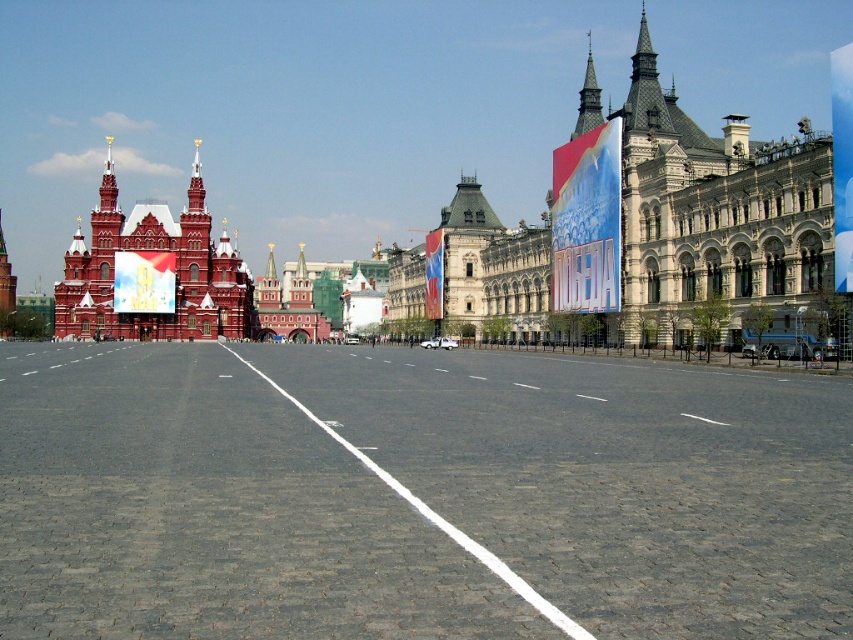
Is matte red palace at left further to the viewer compared to polished brass spire at upper right?

Yes.

Does point (57, 337) lie in front of point (595, 104)?

No, it is behind (595, 104).

The image size is (853, 640). What are the coordinates of `matte red palace at left` in the screenshot? It's located at (154, 268).

Between gray cobblestone plaza at center and polished brass spire at upper right, which one has more height?

polished brass spire at upper right

Does point (404, 364) come closer to viewer compared to point (593, 108)?

No, (404, 364) is further to viewer.

I want to click on gray cobblestone plaza at center, so click(x=416, y=493).

Is point (467, 371) positioned after point (250, 326)?

That is False.

You are a GUI agent. You are given a task and a screenshot of the screen. Output one action in this format:
    pyautogui.click(x=<x>, y=<y>)
    Task: Click on the gray cobblestone plaza at center
    This screenshot has width=853, height=640.
    Given the screenshot: What is the action you would take?
    click(x=416, y=493)